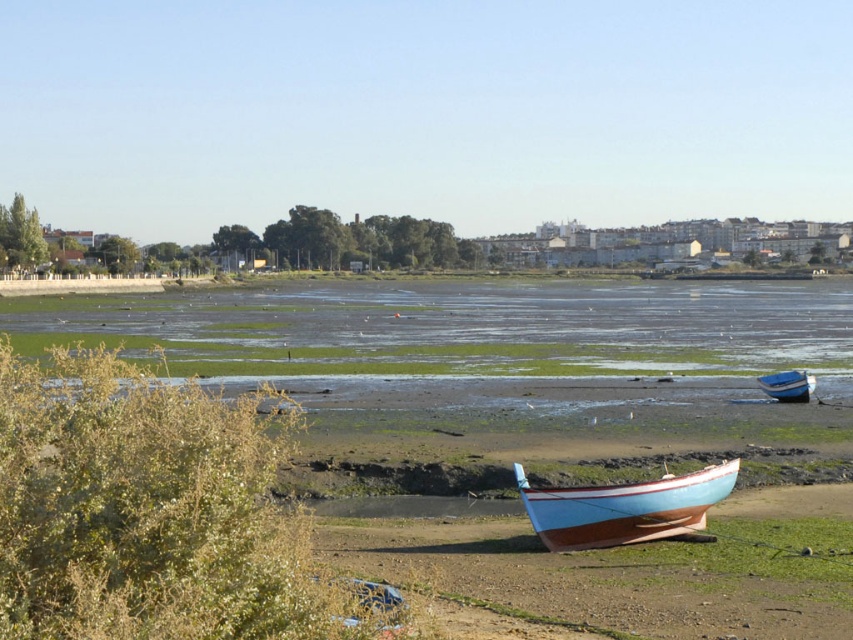
The width and height of the screenshot is (853, 640). Describe the element at coordinates (624, 508) in the screenshot. I see `light blue wooden boat at lower center` at that location.

The width and height of the screenshot is (853, 640). What are the coordinates of `light blue wooden boat at lower center` in the screenshot? It's located at (624, 508).